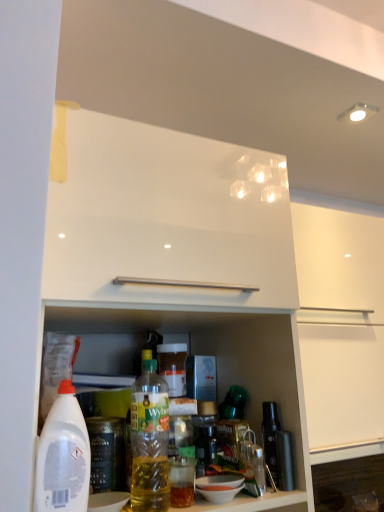
Question: Is point (77, 504) positioned closer to the camera than point (160, 459)?

Choices:
 (A) farther
 (B) closer

Answer: (B)

Question: Considering their positions, is white plastic bottle at lower left, the second bottle positioned from the right, located in front of or behind translucent plastic bottle at center, placed as the second bottle when sorted from left to right?

Choices:
 (A) front
 (B) behind

Answer: (A)

Question: In the image, is white plastic bottle at lower left, the second bottle positioned from the right, on the left side or the right side of translucent plastic bottle at center, positioned as the first bottle in right-to-left order?

Choices:
 (A) right
 (B) left

Answer: (B)

Question: Looking at their shapes, would you say translucent plastic bottle at center, placed as the second bottle when sorted from left to right, is wider or thinner than white plastic bottle at lower left, which ranks as the first bottle in left-to-right order?

Choices:
 (A) wide
 (B) thin

Answer: (A)

Question: Considering the positions of translucent plastic bottle at center, positioned as the first bottle in right-to-left order, and white plastic bottle at lower left, which ranks as the first bottle in left-to-right order, in the image, is translucent plastic bottle at center, positioned as the first bottle in right-to-left order, taller or shorter than white plastic bottle at lower left, which ranks as the first bottle in left-to-right order,?

Choices:
 (A) tall
 (B) short

Answer: (A)

Question: Would you say translucent plastic bottle at center, placed as the second bottle when sorted from left to right, is inside or outside white plastic bottle at lower left, the second bottle positioned from the right?

Choices:
 (A) outside
 (B) inside

Answer: (A)

Question: Considering the positions of point (155, 370) and point (52, 434), is point (155, 370) closer or farther from the camera than point (52, 434)?

Choices:
 (A) closer
 (B) farther

Answer: (B)